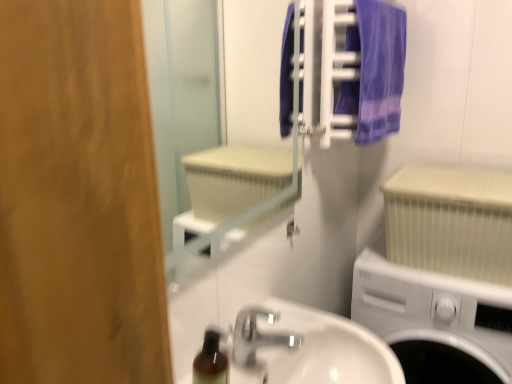
Question: Is the depth of silver metallic faucet at lower center less than that of white textured mirror at upper center?

Choices:
 (A) yes
 (B) no

Answer: (B)

Question: Considering the relative positions of silver metallic faucet at lower center and white textured mirror at upper center in the image provided, is silver metallic faucet at lower center behind white textured mirror at upper center?

Choices:
 (A) no
 (B) yes

Answer: (B)

Question: Considering the relative positions of silver metallic faucet at lower center and white textured mirror at upper center in the image provided, is silver metallic faucet at lower center to the left of white textured mirror at upper center from the viewer's perspective?

Choices:
 (A) yes
 (B) no

Answer: (B)

Question: Does silver metallic faucet at lower center turn towards white textured mirror at upper center?

Choices:
 (A) no
 (B) yes

Answer: (A)

Question: Is silver metallic faucet at lower center positioned with its back to white textured mirror at upper center?

Choices:
 (A) yes
 (B) no

Answer: (B)

Question: Considering the positions of white textured radiator at right and purple fabric towel at upper right in the image, is white textured radiator at right wider or thinner than purple fabric towel at upper right?

Choices:
 (A) wide
 (B) thin

Answer: (A)

Question: Do you think white textured radiator at right is within purple fabric towel at upper right, or outside of it?

Choices:
 (A) inside
 (B) outside

Answer: (B)

Question: From their relative heights in the image, would you say white textured radiator at right is taller or shorter than purple fabric towel at upper right?

Choices:
 (A) tall
 (B) short

Answer: (B)

Question: In the image, is white textured radiator at right positioned in front of or behind purple fabric towel at upper right?

Choices:
 (A) behind
 (B) front

Answer: (A)

Question: From the image's perspective, is white textured radiator at right positioned above or below silver metallic faucet at lower center?

Choices:
 (A) below
 (B) above

Answer: (B)

Question: Relative to silver metallic faucet at lower center, is white textured radiator at right in front or behind?

Choices:
 (A) behind
 (B) front

Answer: (A)

Question: Is white textured radiator at right inside or outside of silver metallic faucet at lower center?

Choices:
 (A) inside
 (B) outside

Answer: (B)

Question: From a real-world perspective, relative to silver metallic faucet at lower center, is white textured radiator at right vertically above or below?

Choices:
 (A) above
 (B) below

Answer: (A)

Question: From their relative heights in the image, would you say silver metallic faucet at lower center is taller or shorter than white glossy sink at center?

Choices:
 (A) tall
 (B) short

Answer: (B)

Question: From the image's perspective, is silver metallic faucet at lower center positioned above or below white glossy sink at center?

Choices:
 (A) above
 (B) below

Answer: (A)